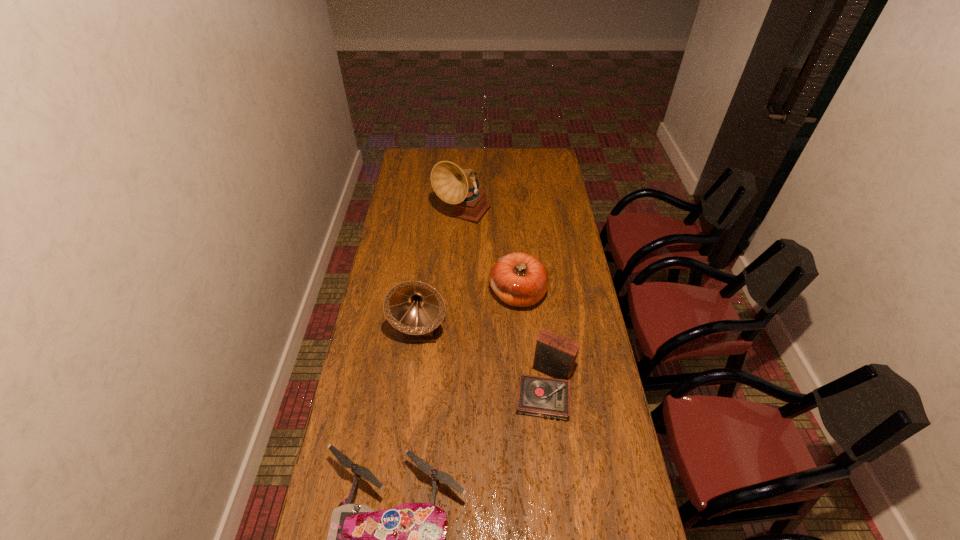
Identify the location of free space located 0.200m on the back of the shortest phonograph record. The height and width of the screenshot is (540, 960). (541, 315).

Image resolution: width=960 pixels, height=540 pixels. Identify the location of object present at the left edge. (415, 308).

You are a GUI agent. You are given a task and a screenshot of the screen. Output one action in this format:
    pyautogui.click(x=<x>, y=<y>)
    Task: Click on the object present at the right edge
    The width and height of the screenshot is (960, 540).
    Given the screenshot: What is the action you would take?
    pyautogui.click(x=555, y=355)

In the image, there is a desktop. Where is `vacant space at the far edge`? vacant space at the far edge is located at coordinates (444, 161).

Identify the location of vacant space at the left edge. (394, 258).

Locate an element on the screen. Image resolution: width=960 pixels, height=540 pixels. vacant region at the right edge of the desktop is located at coordinates (560, 297).

This screenshot has height=540, width=960. I want to click on vacant space at the far right corner of the desktop, so click(x=549, y=158).

I want to click on unoccupied position between the farthest phonograph record and the second shortest phonograph record, so click(x=442, y=273).

Identify the location of empty space that is in between the tallest object and the pumpkin. (491, 255).

The height and width of the screenshot is (540, 960). I want to click on vacant space that is in between the pumpkin and the tallest phonograph record, so click(491, 255).